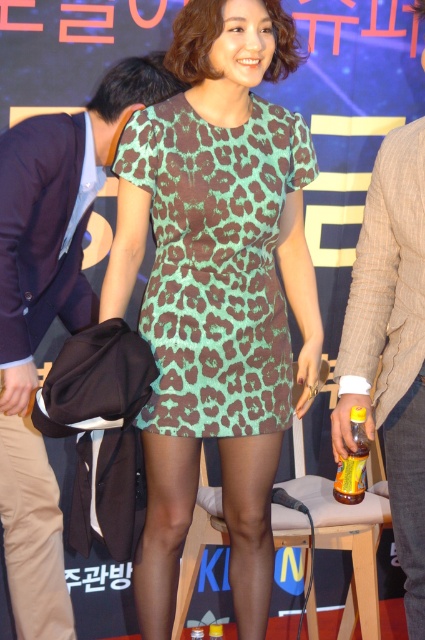
Question: Can you confirm if brown textured blazer at center is bigger than yellow glass bottle at lower center?

Choices:
 (A) no
 (B) yes

Answer: (B)

Question: Which object is closer to the camera taking this photo?

Choices:
 (A) green leopard print dress at center
 (B) brown textured blazer at center
 (C) yellow glass bottle at lower center
 (D) dark blue suit at left

Answer: (B)

Question: Which is farther from the tan/khaki fabric pants at lower left?

Choices:
 (A) yellow glass bottle at lower center
 (B) black leather pants at lower center
 (C) green leopard print dress at center

Answer: (B)

Question: Which is nearer to the dark blue suit at left?

Choices:
 (A) yellow glass bottle at lower center
 (B) green leopard print dress at center
 (C) black leather pants at lower center

Answer: (B)

Question: Is dark blue suit at left smaller than yellow glass bottle at lower center?

Choices:
 (A) yes
 (B) no

Answer: (B)

Question: In this image, where is yellow glass bottle at lower center located relative to translucent plastic bottle at center?

Choices:
 (A) left
 (B) right

Answer: (B)